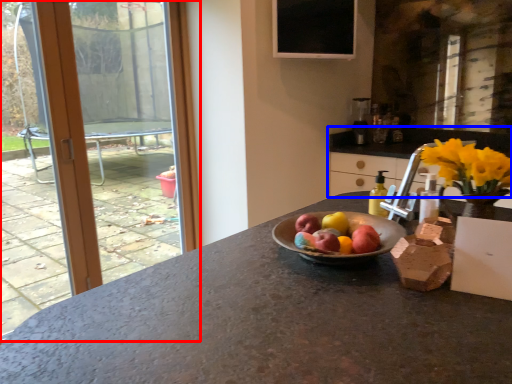
Question: Which object appears farthest to the camera in this image, window (highlighted by a red box) or cabinetry (highlighted by a blue box)?

Choices:
 (A) window
 (B) cabinetry

Answer: (A)